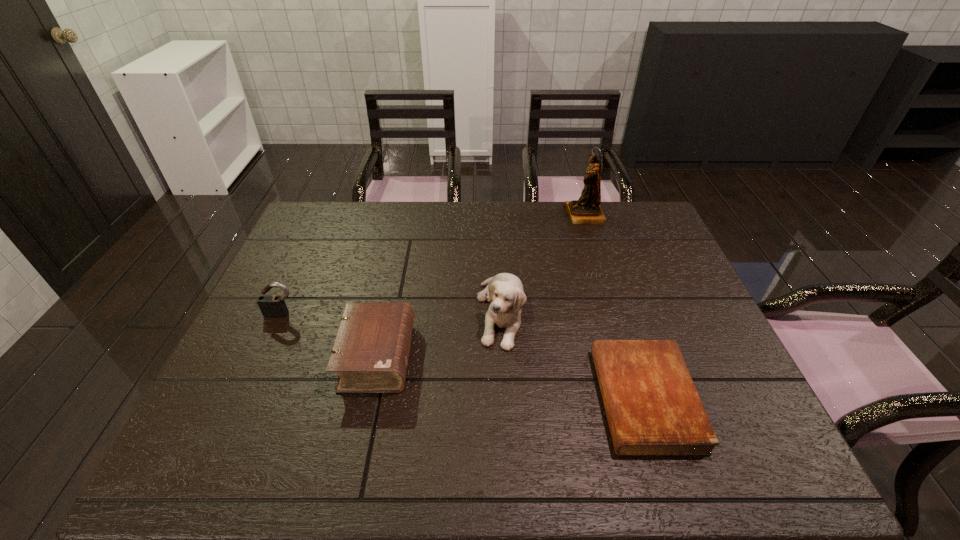
Find the location of `free spot that satisfies the following two spatial constraints: 1. on the front-facing side of the farthest object; 2. on the front-facing side of the third object from left to right`. free spot that satisfies the following two spatial constraints: 1. on the front-facing side of the farthest object; 2. on the front-facing side of the third object from left to right is located at coordinates (615, 313).

Image resolution: width=960 pixels, height=540 pixels. Identify the location of vacant space that satisfies the following two spatial constraints: 1. on the front-facing side of the tallest object; 2. on the front-facing side of the third object from right to left. (615, 313).

Image resolution: width=960 pixels, height=540 pixels. Find the location of `free space that satisfies the following two spatial constraints: 1. on the front-facing side of the figurine; 2. on the front-facing side of the puppy`. free space that satisfies the following two spatial constraints: 1. on the front-facing side of the figurine; 2. on the front-facing side of the puppy is located at coordinates (615, 313).